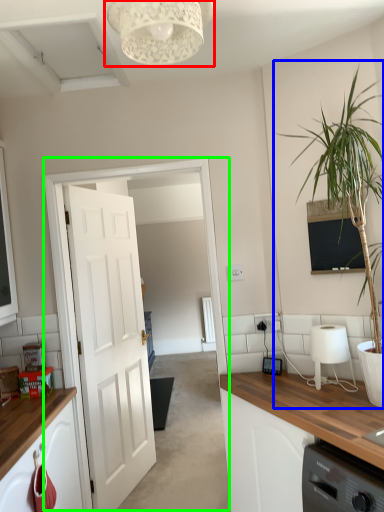
Question: Which object is the closest to the light fixture (highlighted by a red box)? Choose among these: houseplant (highlighted by a blue box) or glass door (highlighted by a green box).

Choices:
 (A) houseplant
 (B) glass door

Answer: (A)